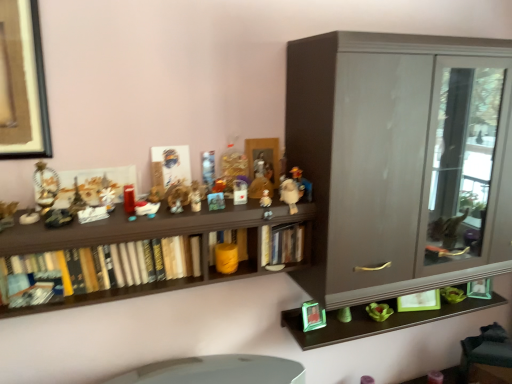
Question: Is metallic gold figurine at left, the twelfth toy when ordered from right to left, at the back of metallic silver toy at center, the 7th toy viewed from the right?

Choices:
 (A) yes
 (B) no

Answer: (B)

Question: From the image's perspective, is metallic silver toy at center, the 7th toy viewed from the right, located above metallic gold figurine at left, marked as the first toy in a left-to-right arrangement?

Choices:
 (A) no
 (B) yes

Answer: (B)

Question: Does metallic silver toy at center, the 7th toy viewed from the right, appear on the right side of metallic gold figurine at left, marked as the first toy in a left-to-right arrangement?

Choices:
 (A) no
 (B) yes

Answer: (B)

Question: Is metallic silver toy at center, the 7th toy viewed from the right, taller than metallic gold figurine at left, marked as the first toy in a left-to-right arrangement?

Choices:
 (A) no
 (B) yes

Answer: (A)

Question: Does metallic silver toy at center, the 7th toy viewed from the right, appear on the left side of metallic gold figurine at left, the twelfth toy when ordered from right to left?

Choices:
 (A) yes
 (B) no

Answer: (B)

Question: Is the position of metallic silver toy at center, the 7th toy viewed from the right, less distant than that of metallic gold figurine at left, the twelfth toy when ordered from right to left?

Choices:
 (A) no
 (B) yes

Answer: (A)

Question: Is the depth of white plastic toy at center, marked as the 4th toy in a right-to-left arrangement, less than that of hardcover book at center, marked as the first book in a right-to-left arrangement?

Choices:
 (A) yes
 (B) no

Answer: (A)

Question: Does white plastic toy at center, which ranks as the 9th toy in left-to-right order, lie behind hardcover book at center, which is counted as the 3th book, starting from the left?

Choices:
 (A) yes
 (B) no

Answer: (B)

Question: Does white plastic toy at center, marked as the 4th toy in a right-to-left arrangement, have a larger size compared to hardcover book at center, marked as the first book in a right-to-left arrangement?

Choices:
 (A) no
 (B) yes

Answer: (A)

Question: From the image's perspective, would you say white plastic toy at center, which ranks as the 9th toy in left-to-right order, is shown under hardcover book at center, marked as the first book in a right-to-left arrangement?

Choices:
 (A) yes
 (B) no

Answer: (B)

Question: From a real-world perspective, is white plastic toy at center, marked as the 4th toy in a right-to-left arrangement, on hardcover book at center, marked as the first book in a right-to-left arrangement?

Choices:
 (A) yes
 (B) no

Answer: (A)

Question: Considering the relative sizes of white plastic toy at center, marked as the 4th toy in a right-to-left arrangement, and hardcover book at center, which is counted as the 3th book, starting from the left, in the image provided, is white plastic toy at center, marked as the 4th toy in a right-to-left arrangement, shorter than hardcover book at center, which is counted as the 3th book, starting from the left,?

Choices:
 (A) no
 (B) yes

Answer: (B)

Question: Does metallic silver toy at center, the 7th toy viewed from the right, have a lesser height compared to white plastic toy at center, marked as the 4th toy in a right-to-left arrangement?

Choices:
 (A) yes
 (B) no

Answer: (B)